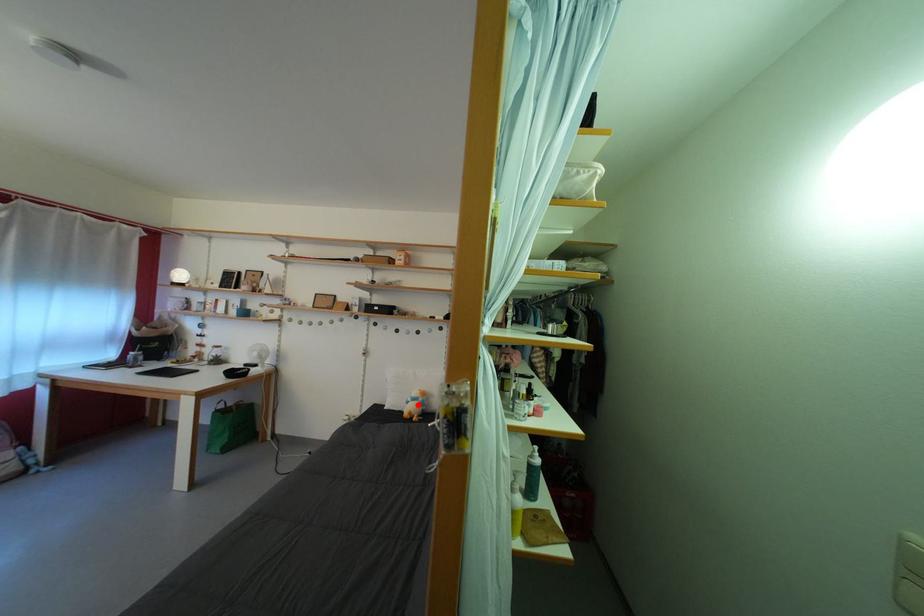
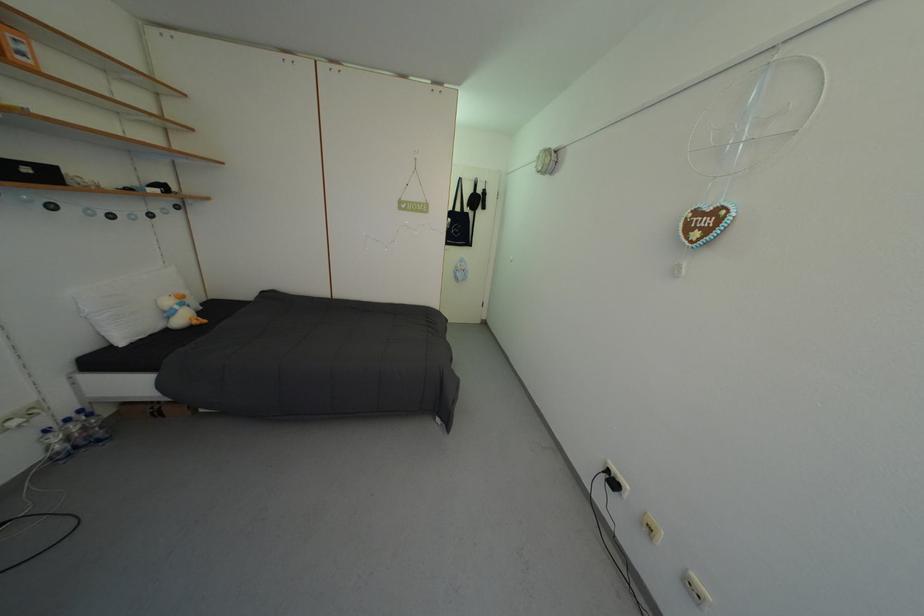
Where in the second image is the point corresponding to the highlighted location from the first image?

(186, 313)